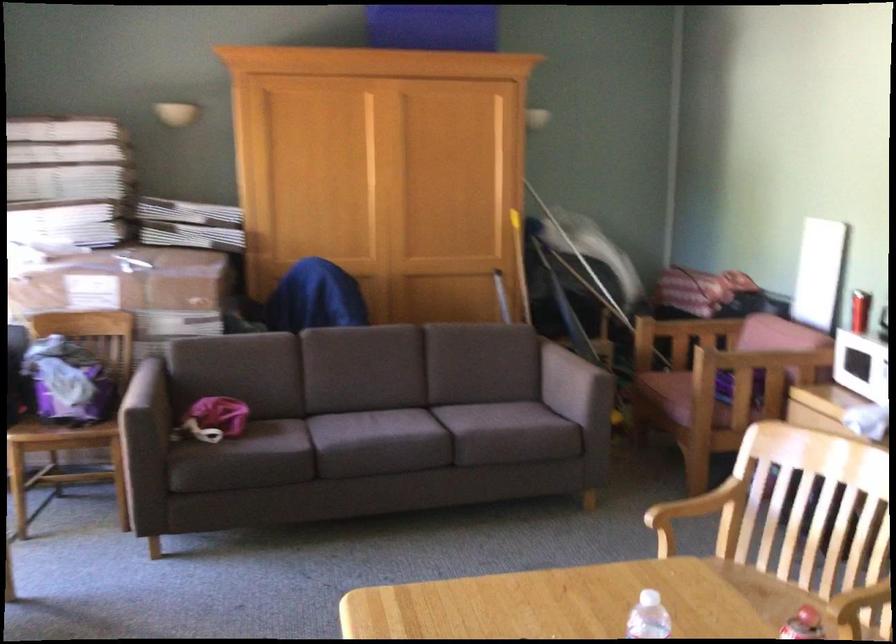
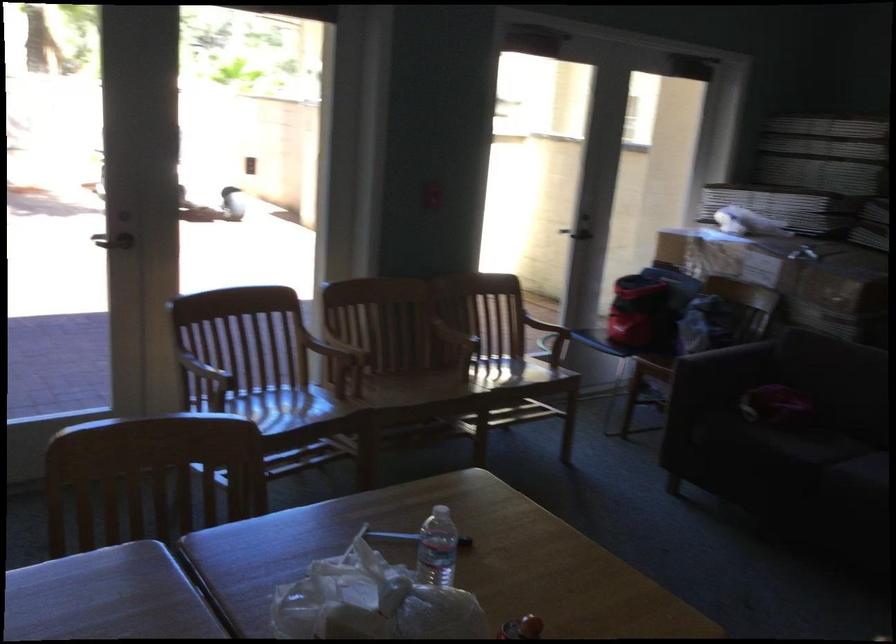
In the second image, find the point that corresponds to point 176,558 in the first image.

(673, 488)